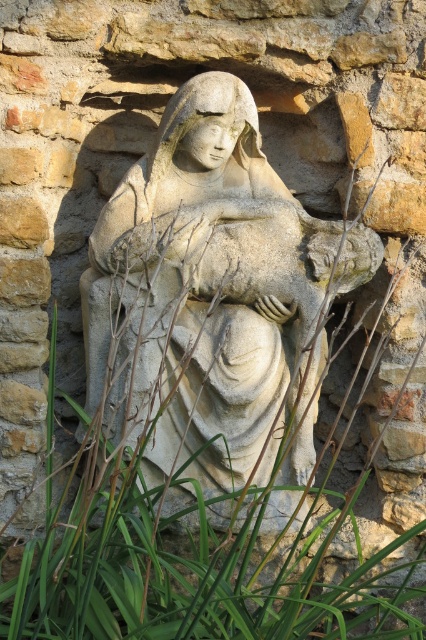
Question: Which of the following is the farthest from the observer?

Choices:
 (A) click(66, 632)
 (B) click(193, 326)

Answer: (B)

Question: Which of the following is the farthest from the observer?

Choices:
 (A) (111, 218)
 (B) (166, 589)

Answer: (A)

Question: In this image, where is stone statue at center located relative to green leafy grass at center?

Choices:
 (A) above
 (B) below

Answer: (A)

Question: Considering the relative positions of stone statue at center and green leafy grass at center in the image provided, where is stone statue at center located with respect to green leafy grass at center?

Choices:
 (A) below
 (B) above

Answer: (B)

Question: Can you confirm if stone statue at center is smaller than green leafy grass at center?

Choices:
 (A) yes
 (B) no

Answer: (A)